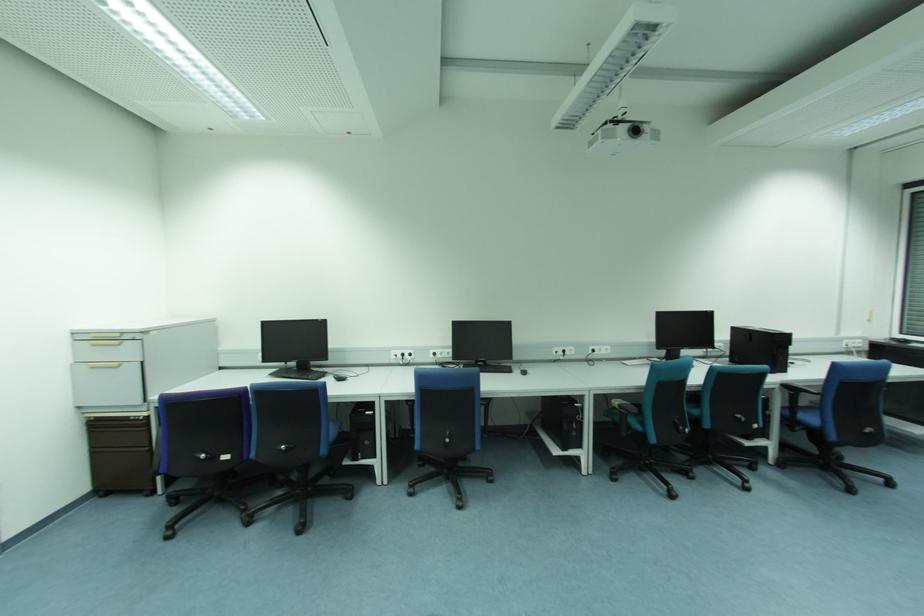
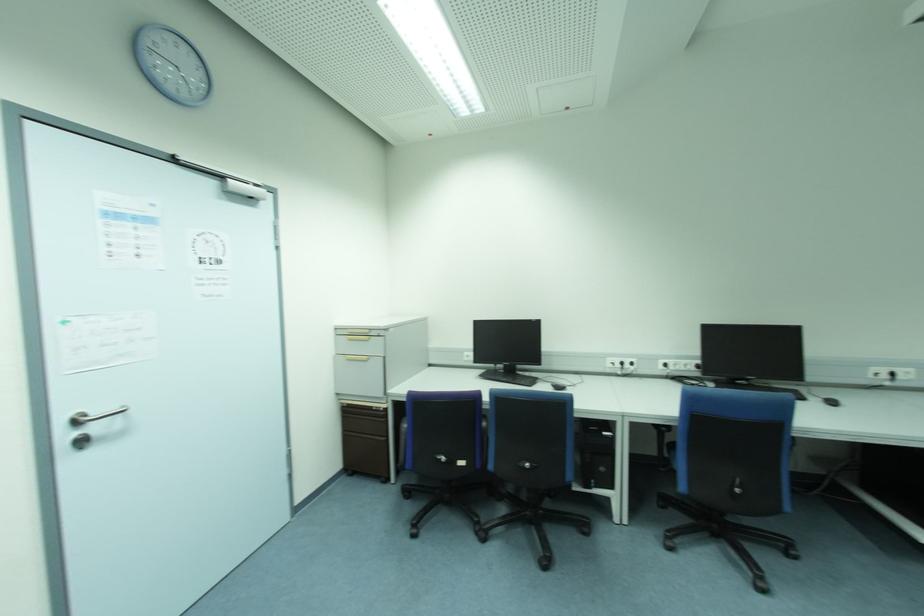
Question: How did the camera likely rotate?

Choices:
 (A) Left
 (B) Right
 (C) Up
 (D) Down

Answer: (A)